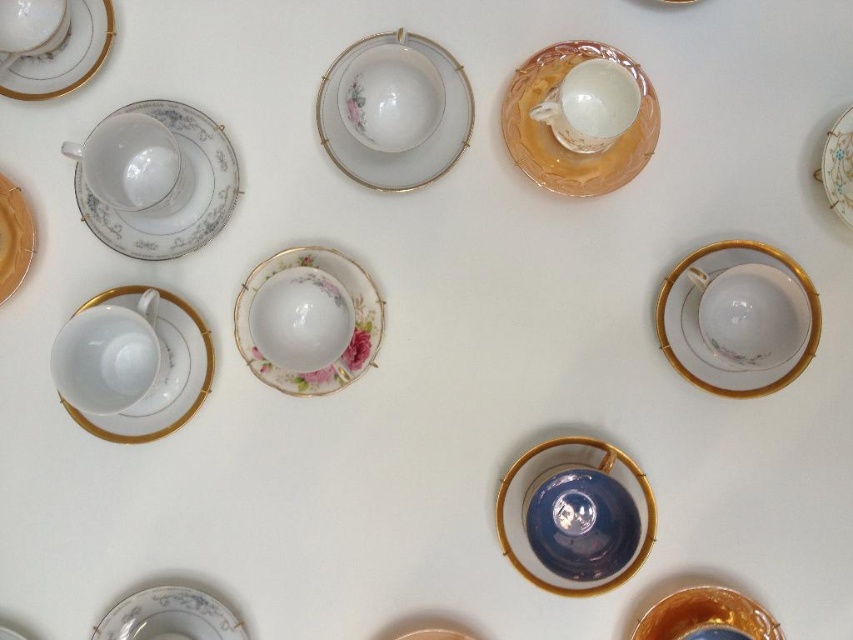
You are at the point marked as point [740,385] and want to reach the point marked as point [106,1]. Which direction should you move in?

You should move backward to reach point [106,1] because point [740,385] is in front of it.

You are arranging a tea set on a table and need to place the porcelain floral saucer at left and the porcelain plate at upper right. Based on their positions, which object is closer to the left edge of the table?

The porcelain floral saucer at left is closer to the left edge of the table since it is positioned to the left of the porcelain plate at upper right.

You are arranging teacups on a table and need to place a new cup on the saucer at point (173, 189). Which saucer should you choose?

The porcelain floral saucer at left is located at point (173, 189), so you should choose the porcelain floral saucer at left.